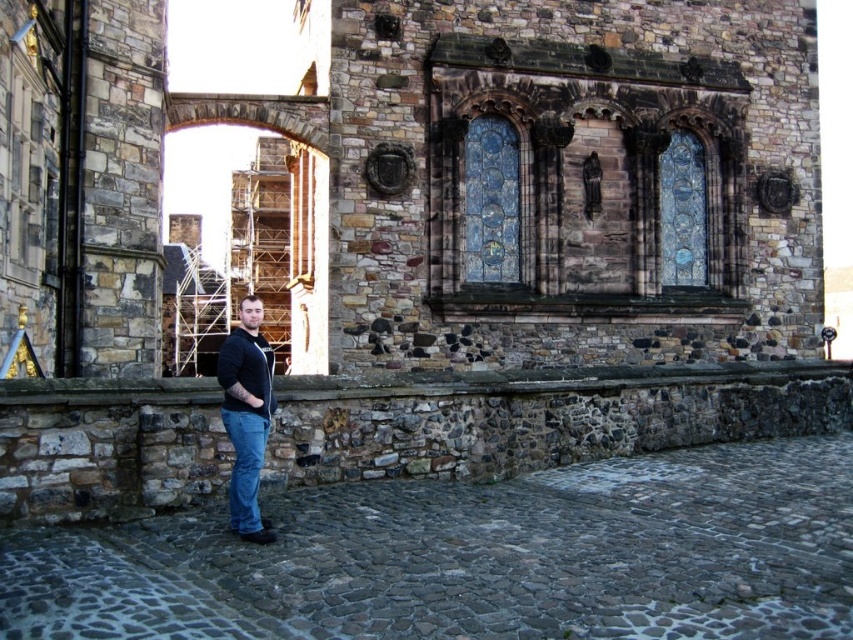
Question: Which point is farther to the camera?

Choices:
 (A) black matte shirt at lower center
 (B) brown stone ledge at center
 (C) denim at lower center

Answer: (A)

Question: Is brown stone ledge at center bigger than denim at lower center?

Choices:
 (A) no
 (B) yes

Answer: (B)

Question: From the image, what is the correct spatial relationship of brown stone ledge at center in relation to black matte jacket at center?

Choices:
 (A) below
 (B) above

Answer: (A)

Question: Which object is farther from the camera taking this photo?

Choices:
 (A) brown stone ledge at center
 (B) denim at lower center

Answer: (A)

Question: From the image, what is the correct spatial relationship of brown stone wall at lower left in relation to black matte jacket at center?

Choices:
 (A) above
 (B) below

Answer: (B)

Question: Which point is farther to the camera?

Choices:
 (A) (250, 452)
 (B) (268, 380)

Answer: (B)